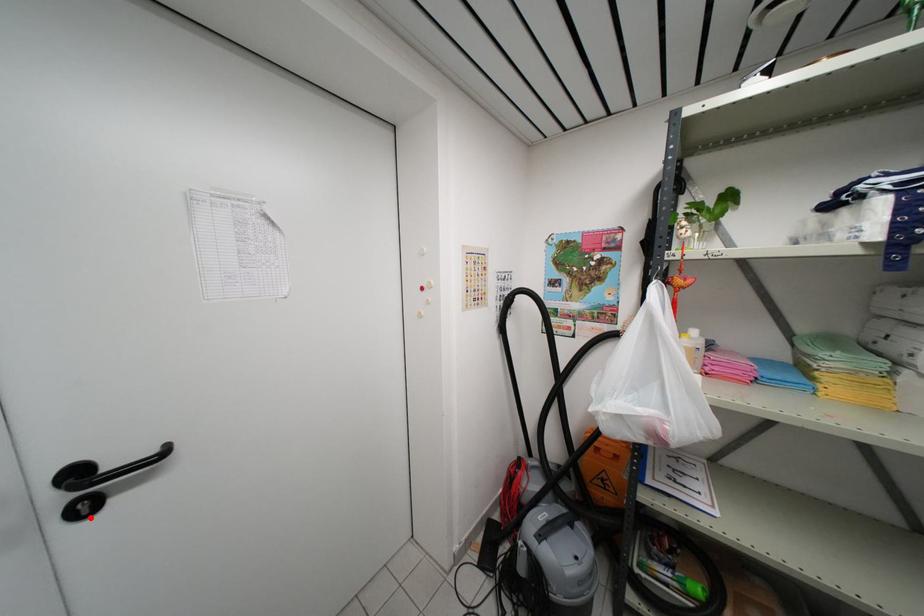
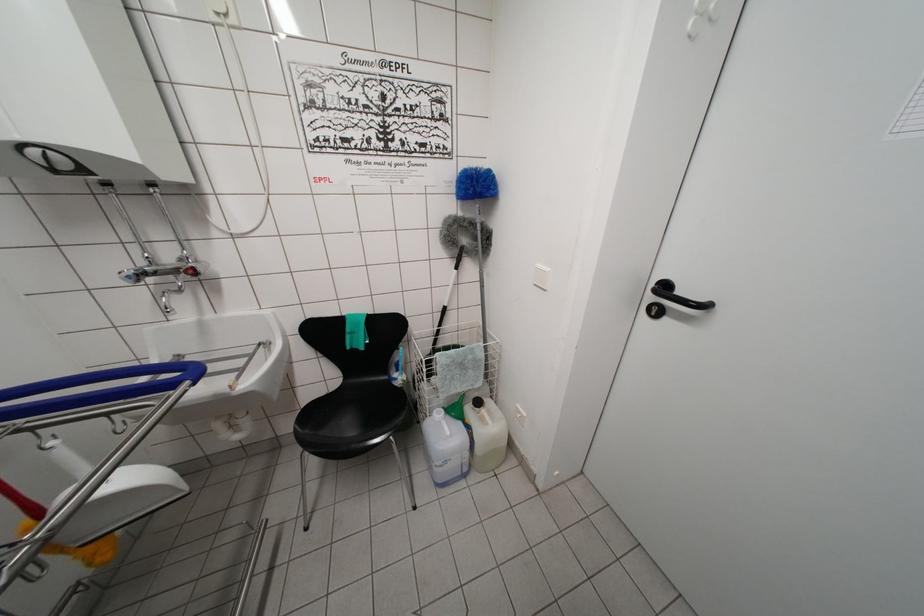
Question: A red point is marked in image1. In image2, is the corresponding 3D point closer to the camera or farther? Reply with the corresponding letter.

Choices:
 (A) The corresponding 3D point is closer.
 (B) The corresponding 3D point is farther.

Answer: (B)